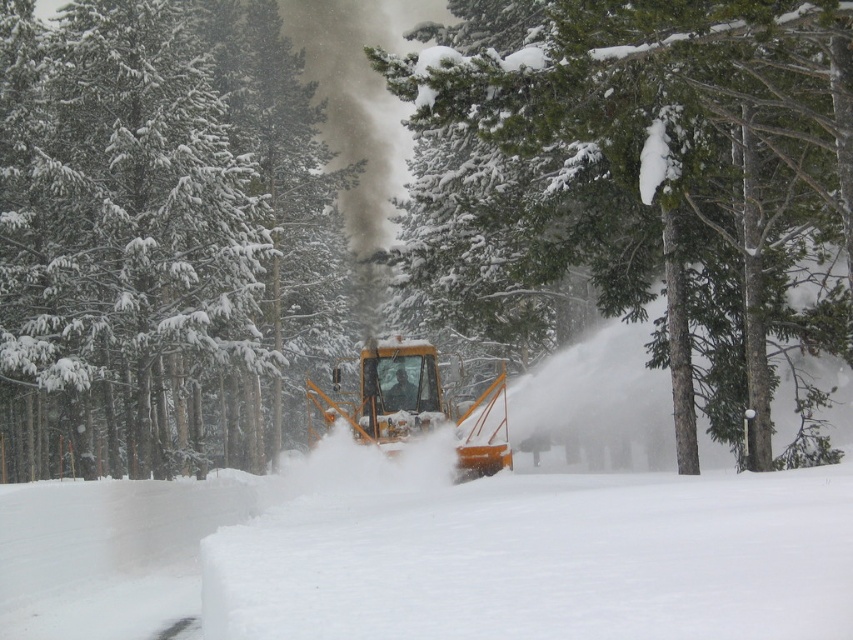
Question: Does snow-covered pine tree at left have a greater width compared to yellow metallic snowplow at center?

Choices:
 (A) yes
 (B) no

Answer: (A)

Question: Is green textured pine tree at center below yellow metallic snowplow at center?

Choices:
 (A) no
 (B) yes

Answer: (A)

Question: Which point is closer to the camera?

Choices:
 (A) yellow metallic snowplow at center
 (B) snow-covered pine tree at left
 (C) green textured pine tree at center

Answer: (C)

Question: Which is farther from the snow-covered pine tree at left?

Choices:
 (A) green textured pine tree at center
 (B) yellow metallic snowplow at center

Answer: (A)

Question: Which point is farther to the camera?

Choices:
 (A) green textured pine tree at center
 (B) snow-covered pine tree at left

Answer: (B)

Question: Can you confirm if snow-covered pine tree at left is positioned to the right of green textured pine tree at center?

Choices:
 (A) no
 (B) yes

Answer: (A)